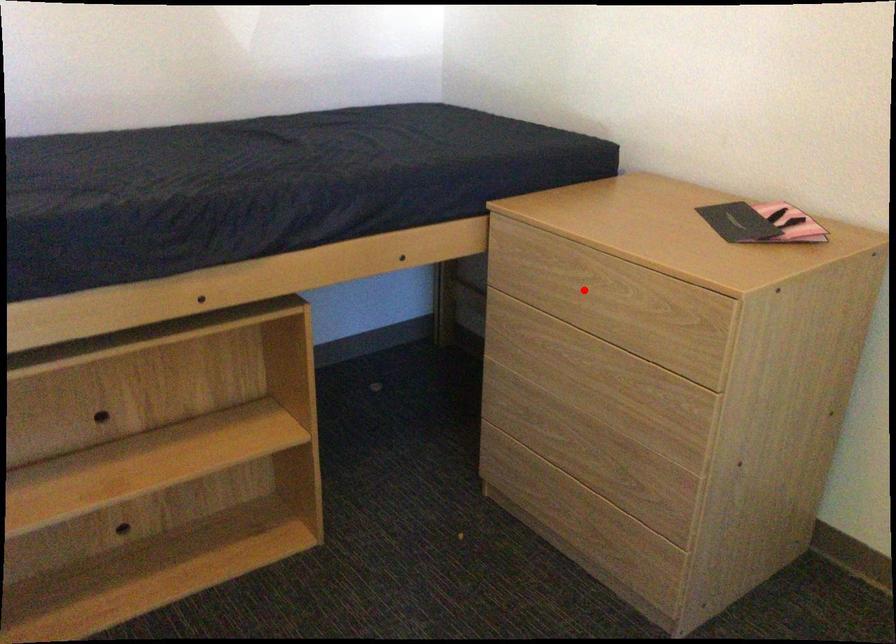
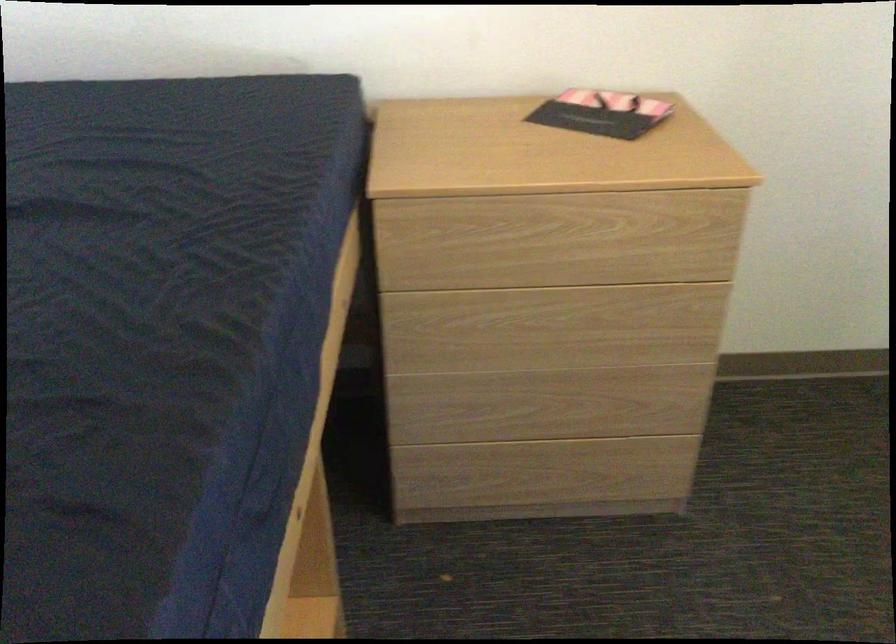
Question: I am providing you with two images of the same scene from different viewpoints. A red point is shown in image1. For the corresponding object point in image2, is it positioned nearer or farther from the camera?

Choices:
 (A) Nearer
 (B) Farther

Answer: (A)